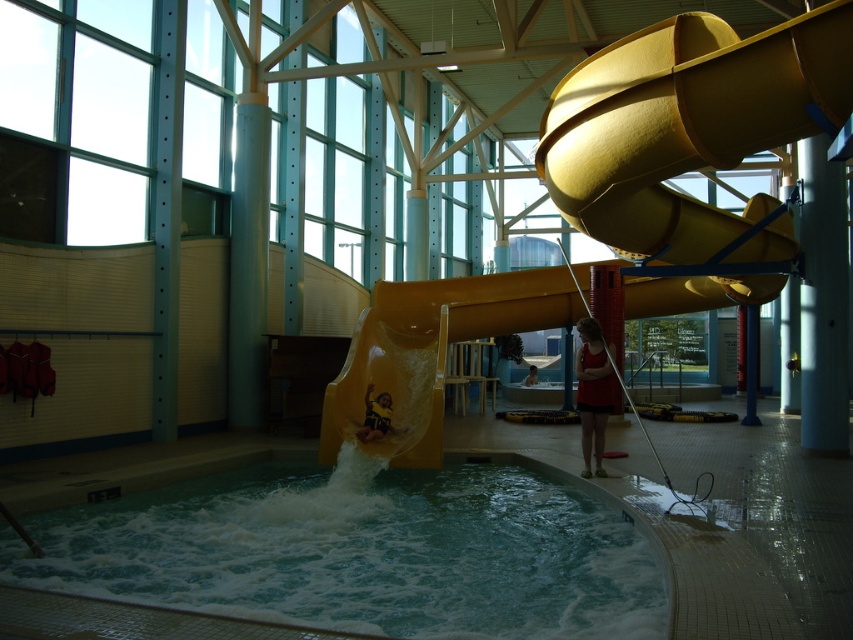
Question: Which point appears farthest from the camera in this image?

Choices:
 (A) (440, 304)
 (B) (387, 419)

Answer: (A)

Question: Is yellow rubber slide at center wider than red matte shorts at lower center?

Choices:
 (A) no
 (B) yes

Answer: (B)

Question: Which of these objects is positioned farthest from the smooth yellow slide at center?

Choices:
 (A) clear glass swimming pool at lower center
 (B) dark blue fabric at center

Answer: (A)

Question: From the image, what is the correct spatial relationship of yellow rubber slide at center in relation to dark blue fabric at center?

Choices:
 (A) below
 (B) above

Answer: (B)

Question: Which of the following is the closest to the observer?

Choices:
 (A) (345, 384)
 (B) (419, 416)

Answer: (A)

Question: Does yellow matte slide at center appear on the right side of smooth yellow slide at center?

Choices:
 (A) no
 (B) yes

Answer: (A)